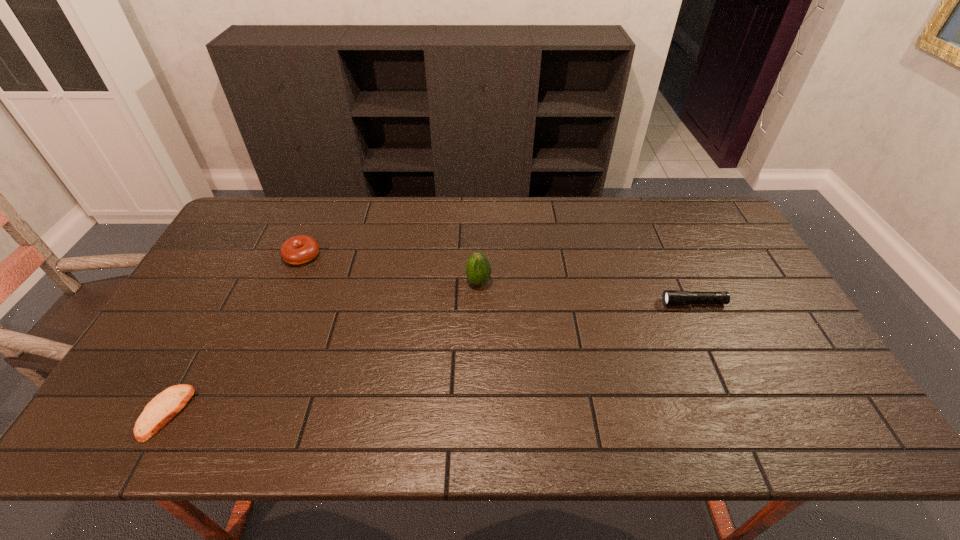
The height and width of the screenshot is (540, 960). What are the coordinates of `vacant space at the right edge of the desktop` in the screenshot? It's located at (724, 246).

At what (x,y) coordinates should I click in order to perform the action: click on vacant space at the near left corner. Please return your answer as a coordinate pair (x, y). The width and height of the screenshot is (960, 540). Looking at the image, I should click on (113, 429).

This screenshot has width=960, height=540. Identify the location of free region at the far right corner. (722, 231).

Find the location of a particular element. free space between the rightmost object and the farthest object is located at coordinates (497, 279).

Where is `vacant region between the tallest object and the farthest object`? vacant region between the tallest object and the farthest object is located at coordinates (391, 268).

I want to click on vacant area between the third nearest object and the doughnut, so click(391, 268).

Find the location of a particular element. The width and height of the screenshot is (960, 540). free space between the farthest object and the pita bread is located at coordinates (234, 334).

I want to click on free space between the flashlight and the avocado, so click(586, 292).

Image resolution: width=960 pixels, height=540 pixels. What are the coordinates of `free spot between the shortest object and the tallest object` in the screenshot? It's located at (323, 347).

You are a GUI agent. You are given a task and a screenshot of the screen. Output one action in this format:
    pyautogui.click(x=<x>, y=<y>)
    Task: Click on the unoccupied position between the leftmost object and the avocado
    
    Given the screenshot: What is the action you would take?
    pyautogui.click(x=323, y=347)